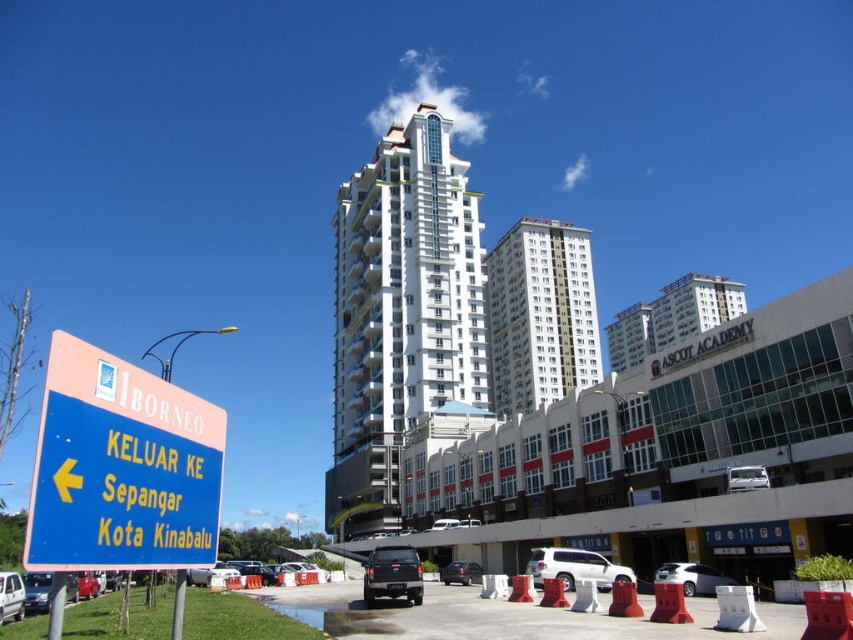
Is point (459, 573) farther from viewer compared to point (514, 579)?

Yes, point (459, 573) is behind point (514, 579).

I want to click on matte black car at lower center, so click(461, 572).

Between point (444, 580) and point (515, 584), which one is positioned in front?

Point (515, 584)

Locate an element on the screen. matte black car at lower center is located at coordinates (461, 572).

Who is positioned more to the right, blue plastic sign at left or matte black car at lower center?

From the viewer's perspective, matte black car at lower center appears more on the right side.

Between blue plastic sign at left and matte black car at lower center, which one appears on the left side from the viewer's perspective?

blue plastic sign at left is more to the left.

This screenshot has height=640, width=853. What do you see at coordinates (120, 467) in the screenshot?
I see `blue plastic sign at left` at bounding box center [120, 467].

The image size is (853, 640). In order to click on blue plastic sign at left in this screenshot , I will do `click(120, 467)`.

Is white smooth building at center bigger than red plastic cone at center?

Yes, white smooth building at center is bigger than red plastic cone at center.

How distant is white smooth building at center from red plastic cone at center?

A distance of 341.05 feet exists between white smooth building at center and red plastic cone at center.

Is point (541, 253) less distant than point (555, 586)?

No, it is not.

Find the location of a particular element. The image size is (853, 640). white smooth building at center is located at coordinates (538, 314).